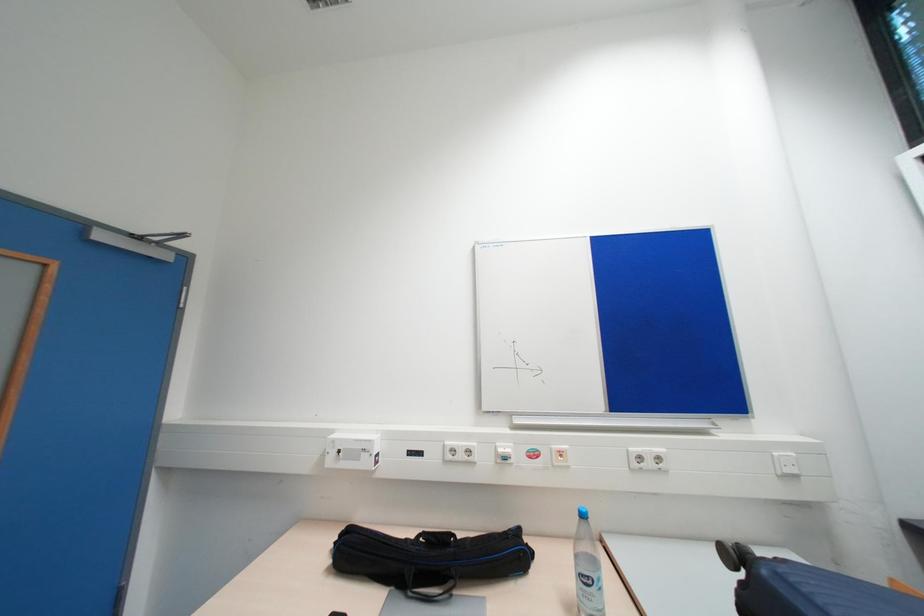
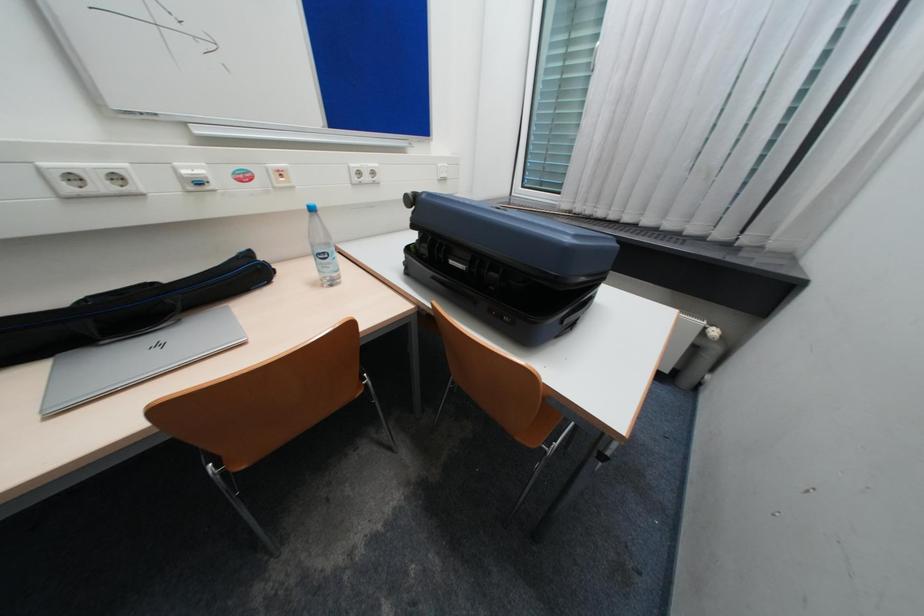
First-person continuous shooting, in which direction is the camera rotating?

The camera's rotation is toward right-down.